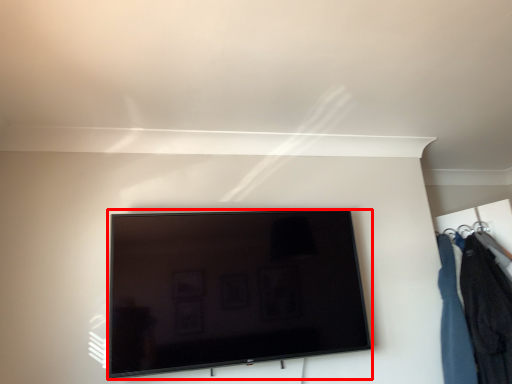
Question: Considering the relative positions of television (annotated by the red box) and closet in the image provided, where is television (annotated by the red box) located with respect to the staircase?

Choices:
 (A) left
 (B) right

Answer: (A)